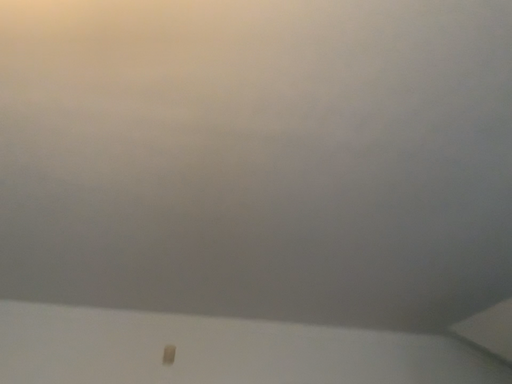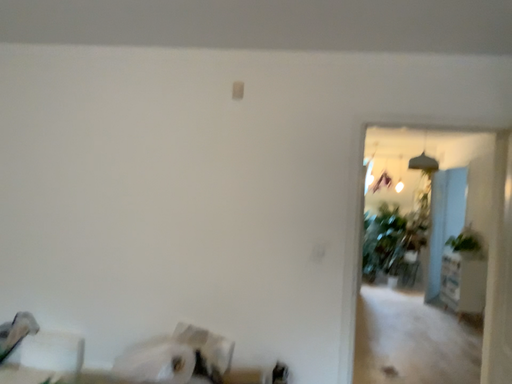
Question: How did the camera likely rotate when shooting the video?

Choices:
 (A) rotated downward
 (B) rotated upward

Answer: (A)